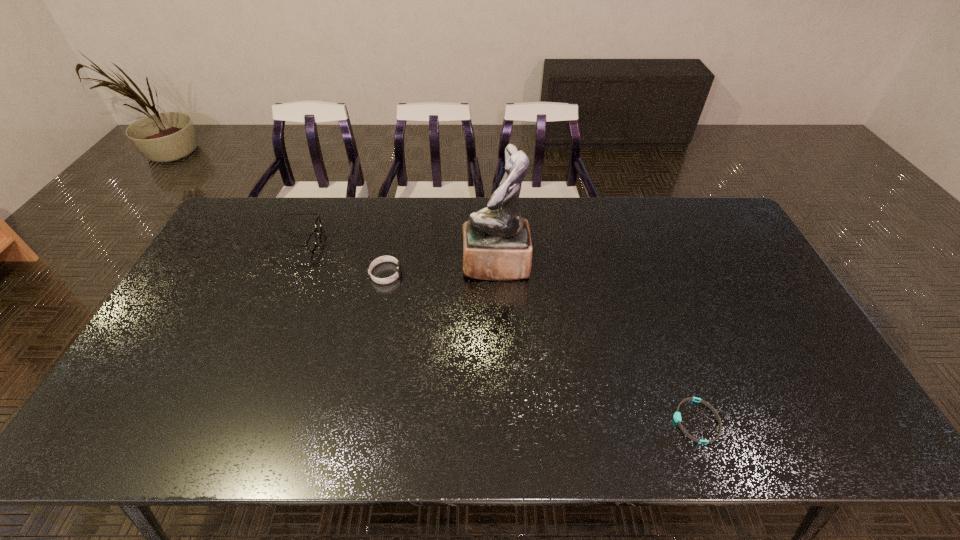
Where is `free spot between the right wristband and the leftmost object`? free spot between the right wristband and the leftmost object is located at coordinates (496, 330).

You are a GUI agent. You are given a task and a screenshot of the screen. Output one action in this format:
    pyautogui.click(x=<x>, y=<y>)
    Task: Click on the free space between the spectacles and the nearest object
    
    Given the screenshot: What is the action you would take?
    pyautogui.click(x=496, y=330)

Locate an element on the screen. vacant area between the second object from right to left and the farther wristband is located at coordinates pyautogui.click(x=441, y=269).

Where is `object that ranks as the second closest to the left wristband`? This screenshot has height=540, width=960. object that ranks as the second closest to the left wristband is located at coordinates (311, 242).

Locate which object ranks second in proximity to the third shortest object. Please provide its 2D coordinates. Your answer should be formatted as a tuple, i.e. [(x, y)], where the tuple contains the x and y coordinates of a point satisfying the conditions above.

[(497, 245)]